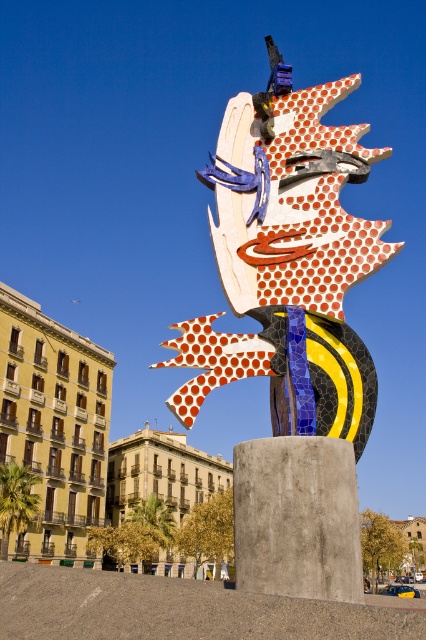
You are an art student analyzing the public art installation. The coordinates given are part of the artwork. Where on the sculpture would you find the point at coordinates (290, 332)?

The point at coordinates (290, 332) marks the polka dot mosaic face at center.

You are an art student analyzing the sculpture. You notice two points on the sculpture. The first point is at coordinates point (267, 456) and the second at point (187, 467). From your perspective, which point is closer to you?

Point (267, 456) is in front of point (187, 467), so the first point is closer to you.